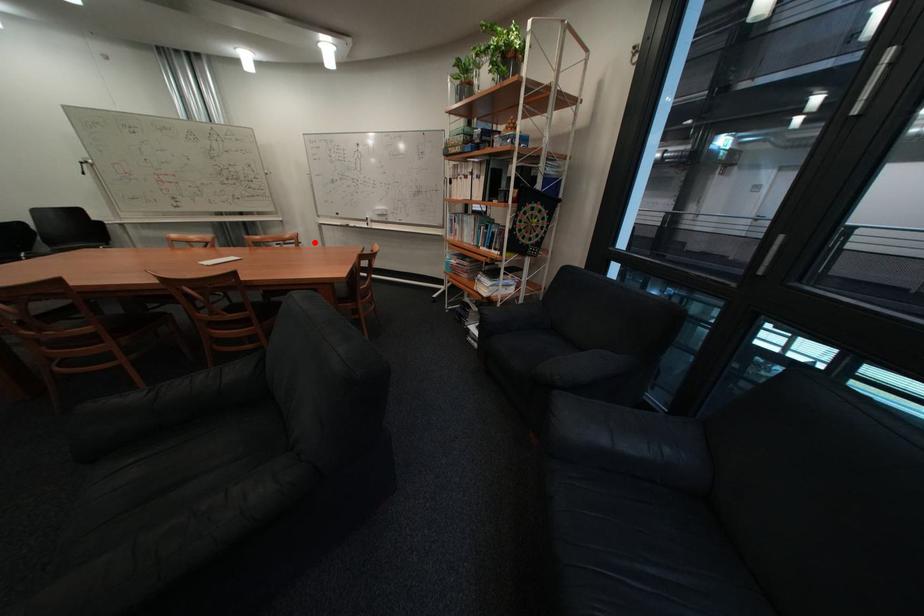
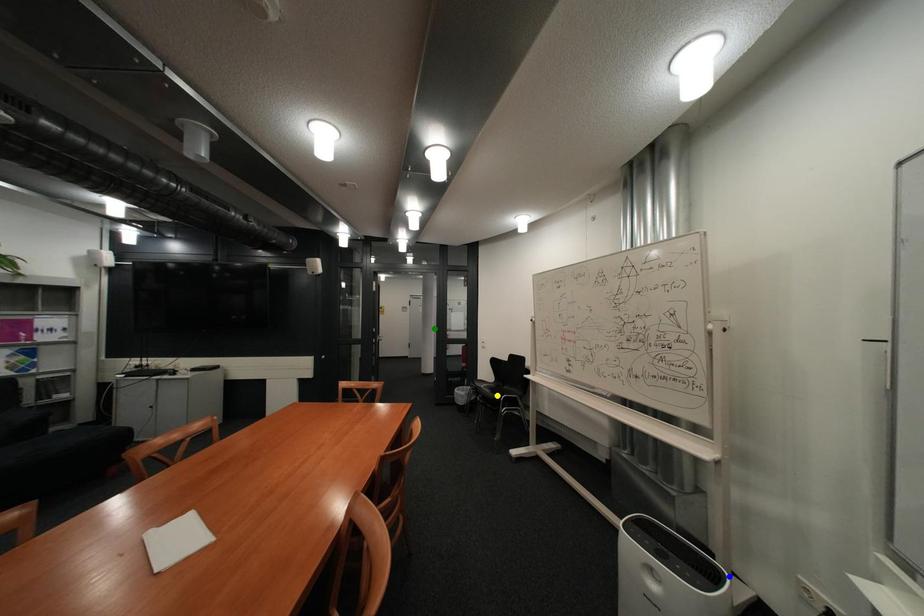
Question: I am providing you with two images of the same scene from different viewpoints. A red point is marked on the first image. You are given multiple points on the second image. In image 2, which mark is for the same physical point as the one in image 1?

Choices:
 (A) blue point
 (B) yellow point
 (C) green point

Answer: (A)